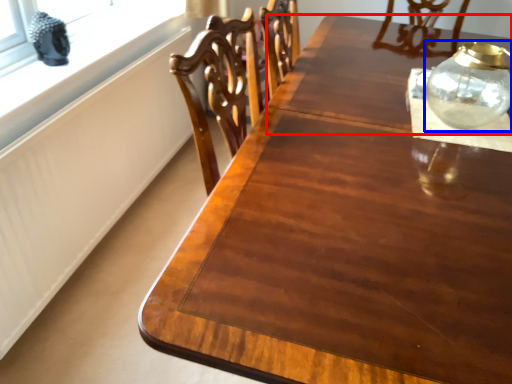
Question: Among these objects, which one is nearest to the camera, round table (highlighted by a red box) or glass vase (highlighted by a blue box)?

Choices:
 (A) round table
 (B) glass vase

Answer: (B)